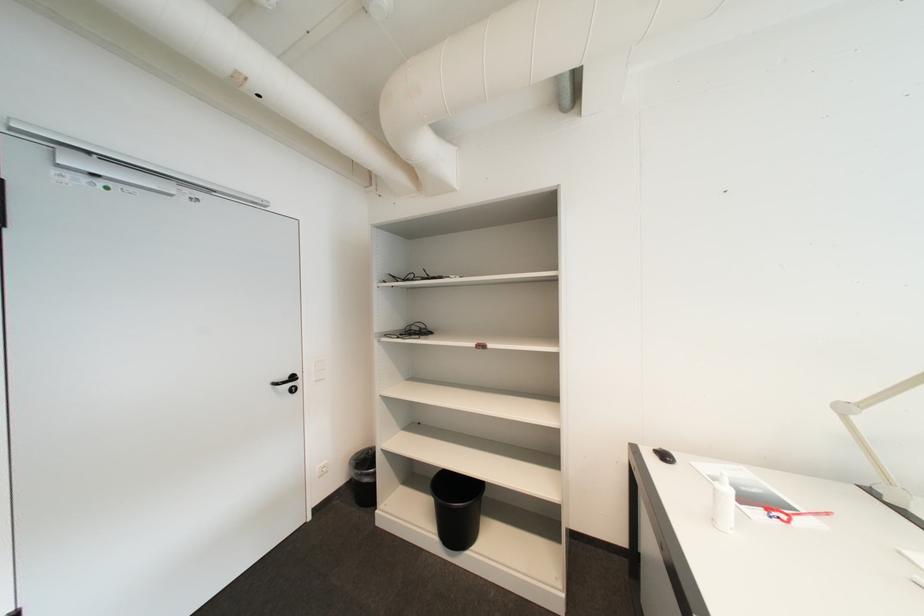
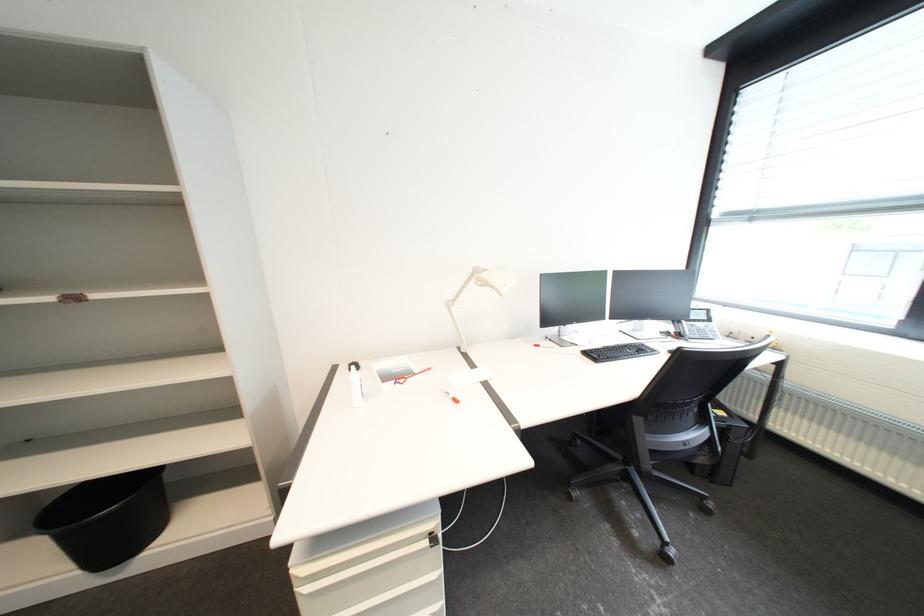
Question: The camera is either moving clockwise (left) or counter-clockwise (right) around the object. The first image is from the beginning of the video and the second image is from the end. Is the camera moving left or right when shooting the video?

Choices:
 (A) Left
 (B) Right

Answer: (A)